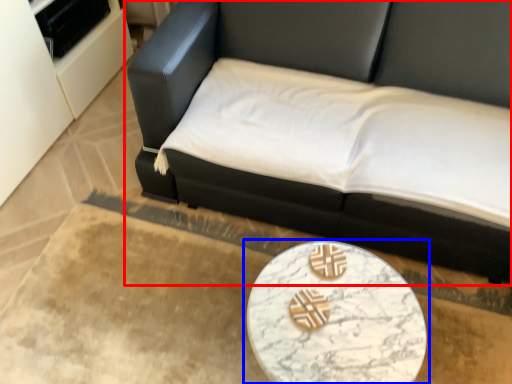
Question: Which point is closer to the camera, studio couch (highlighted by a red box) or table (highlighted by a blue box)?

Choices:
 (A) studio couch
 (B) table

Answer: (A)